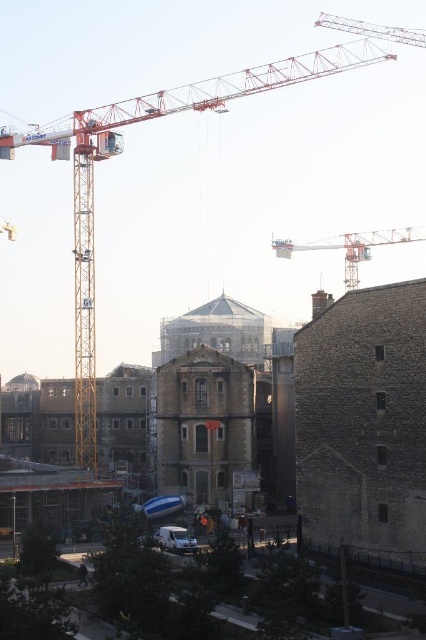
Who is lower down, brown stone tower at center or orange metallic crane at upper center?

brown stone tower at center

Based on the photo, does brown stone tower at center lie behind orange metallic crane at upper center?

No, brown stone tower at center is in front of orange metallic crane at upper center.

Who is more distant from viewer, (x=215, y=444) or (x=394, y=243)?

Positioned behind is point (x=394, y=243).

You are a GUI agent. You are given a task and a screenshot of the screen. Output one action in this format:
    pyautogui.click(x=<x>, y=<y>)
    Task: Click on the brown stone tower at center
    
    Given the screenshot: What is the action you would take?
    pyautogui.click(x=204, y=424)

Can you confirm if orange metallic crane at upper left is positioned below brown stone tower at center?

No, orange metallic crane at upper left is not below brown stone tower at center.

Measure the distance between orange metallic crane at upper left and camera.

The distance of orange metallic crane at upper left from camera is 108.71 meters.

Which is behind, point (85, 381) or point (155, 371)?

The point (85, 381) is behind.

I want to click on orange metallic crane at upper left, so click(158, 116).

Measure the distance between point (333, 17) and camera.

Point (333, 17) and camera are 255.60 meters apart from each other.

Consider the image. Is the position of orange metallic crane at upper left less distant than that of orange metallic crane at upper center?

Yes, orange metallic crane at upper left is closer to the viewer.

Which is behind, point (92, 120) or point (379, 230)?

Point (379, 230)

Where is `orange metallic crane at upper left`? Image resolution: width=426 pixels, height=640 pixels. orange metallic crane at upper left is located at coordinates (158, 116).